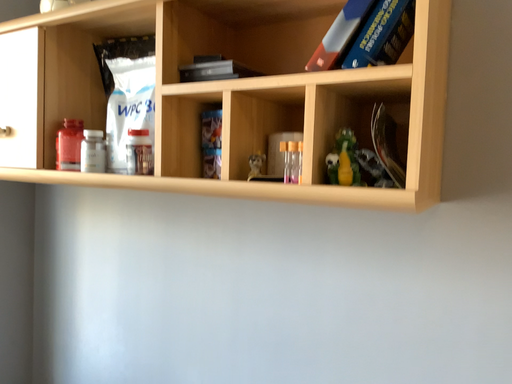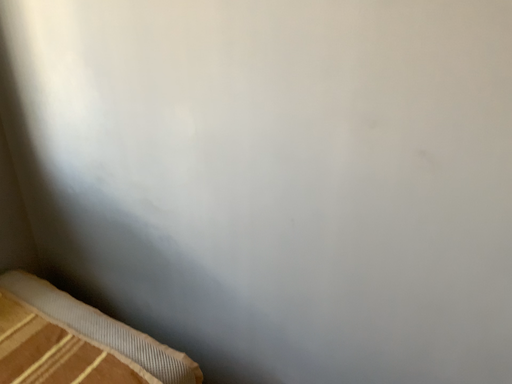
Question: How did the camera likely rotate when shooting the video?

Choices:
 (A) rotated upward
 (B) rotated downward

Answer: (B)